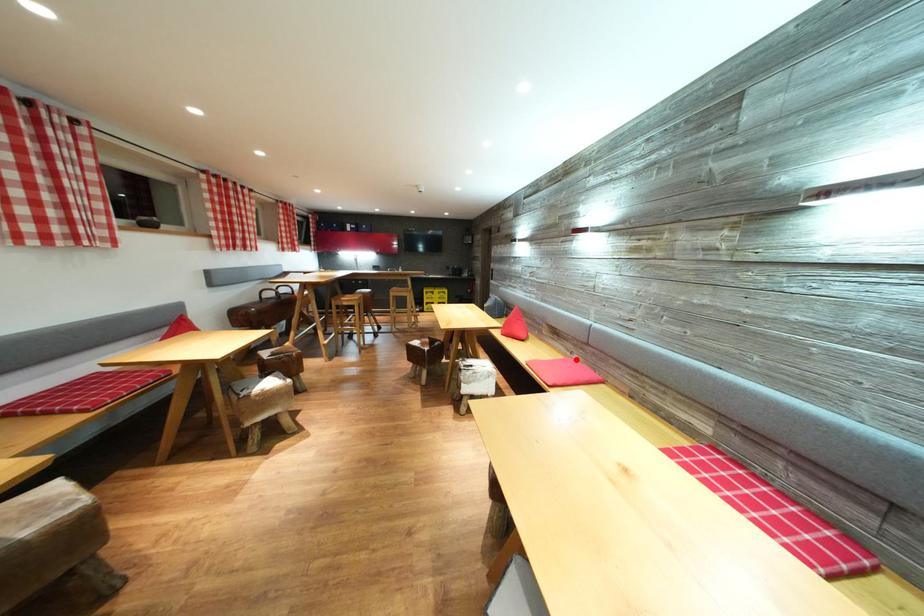
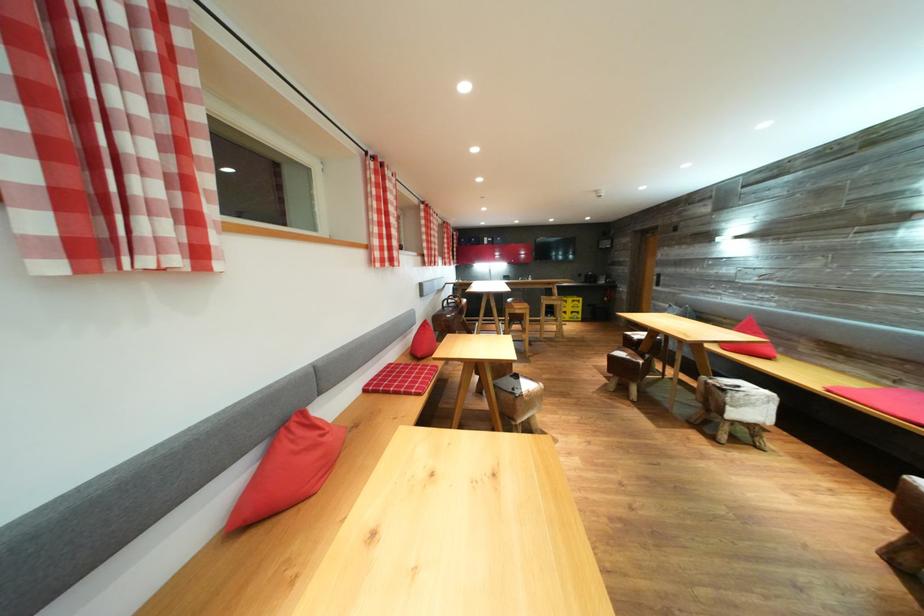
Question: I am providing you with two images of the same scene from different viewpoints. Given a red point in image1, look at the same physical point in image2. Is it:

Choices:
 (A) Closer to the viewpoint
 (B) Farther from the viewpoint

Answer: (B)